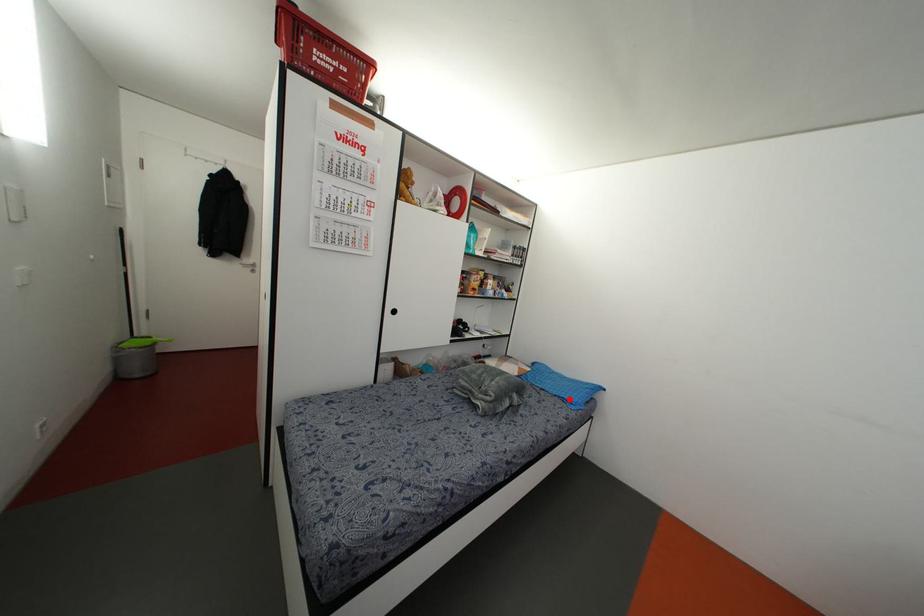
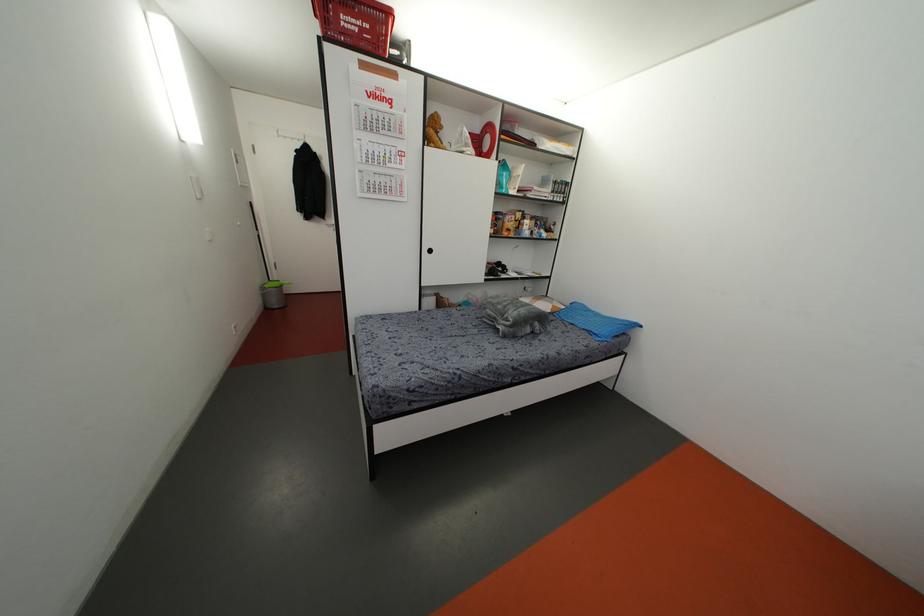
Where in the second image is the point corresponding to the highlighted location from the first image?

(596, 331)